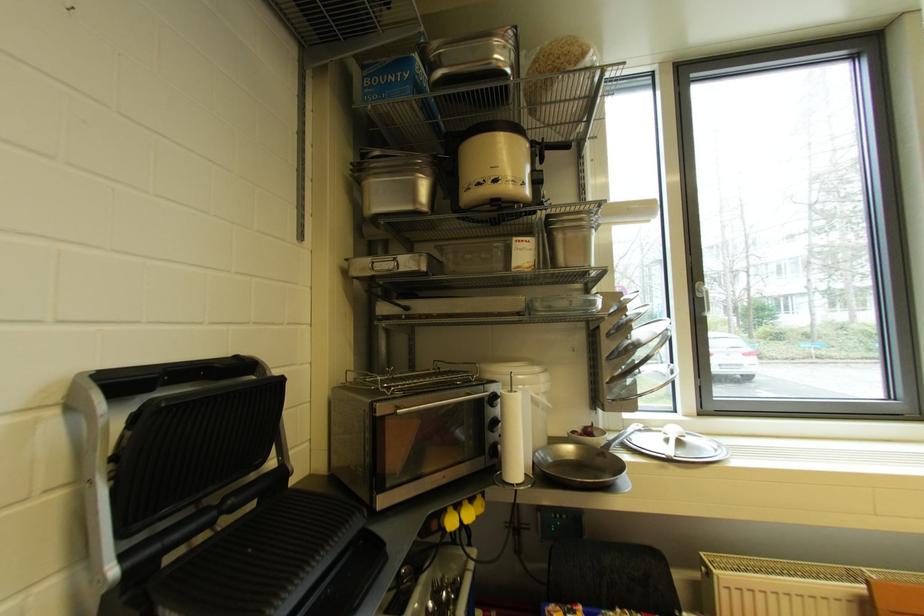
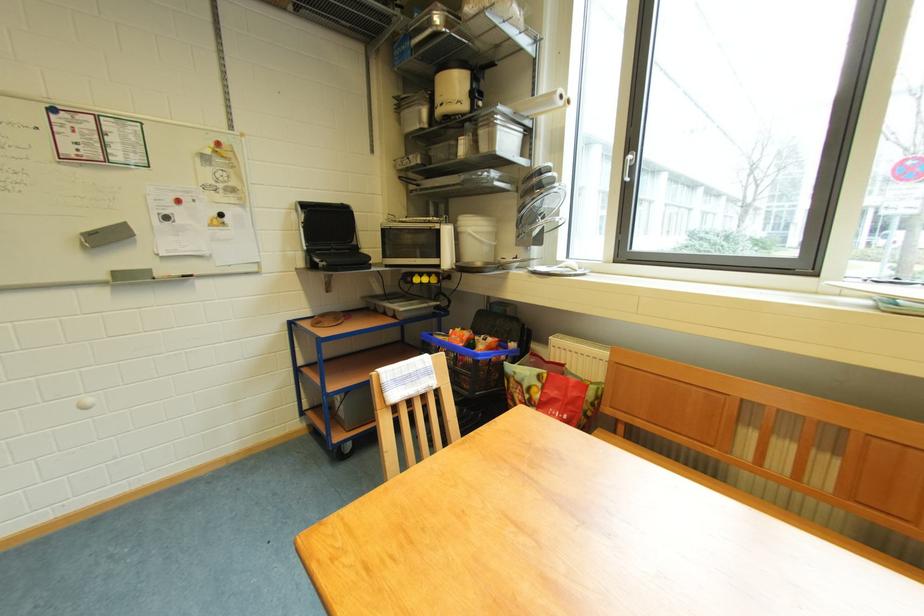
In the second image, find the point that corresponds to pixel 476 517 in the first image.

(432, 283)